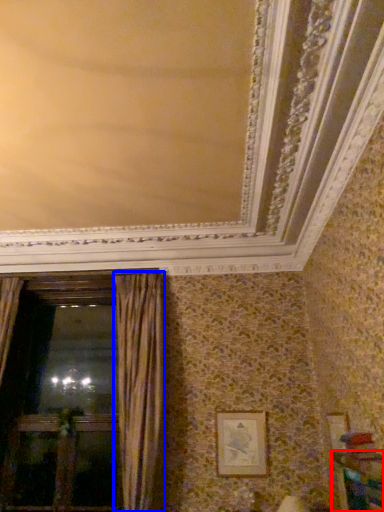
Question: Which point is further to the camera, furniture (highlighted by a red box) or curtain (highlighted by a blue box)?

Choices:
 (A) furniture
 (B) curtain

Answer: (B)